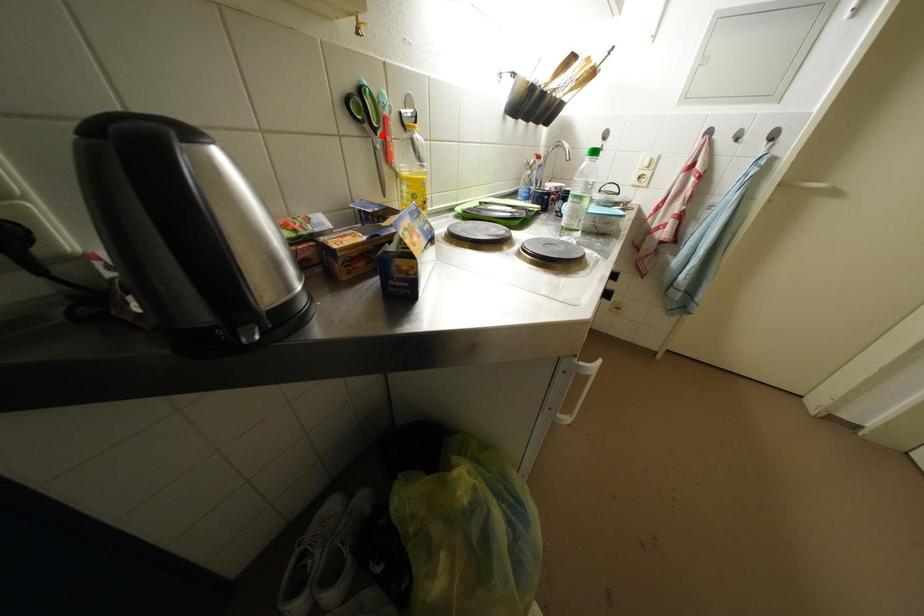
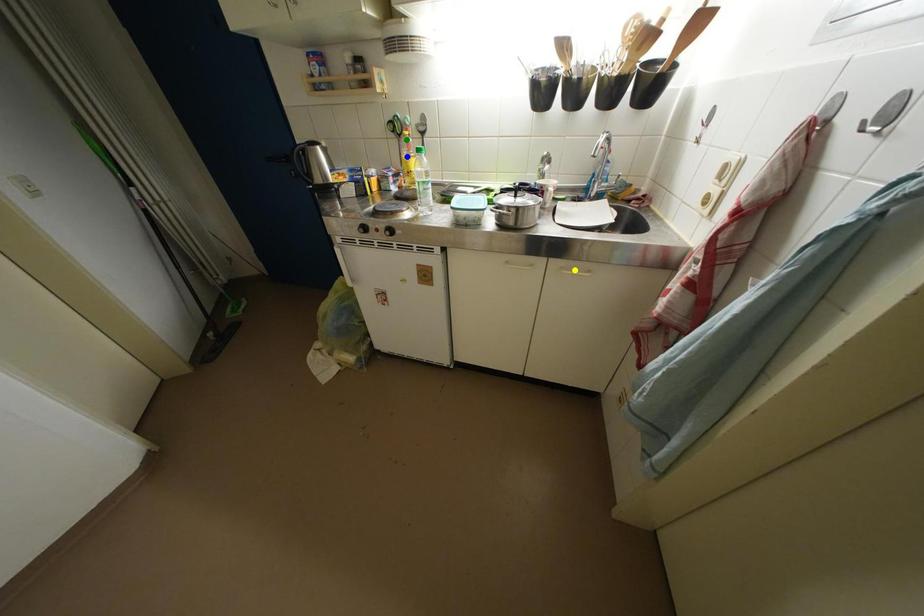
Question: I am providing you with two images of the same scene from different viewpoints. A red point is marked on the first image. You are given multiple points on the second image. Can you choose the point in image 2 that corresponds to the point in image 1?

Choices:
 (A) blue point
 (B) yellow point
 (C) green point

Answer: (C)